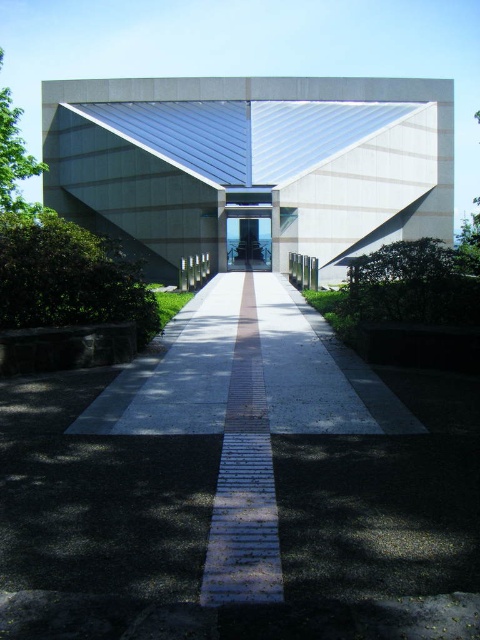
Question: Which point is farther to the camera?

Choices:
 (A) (268, 432)
 (B) (233, 160)
 (C) (254, 227)

Answer: (C)

Question: Is brick paved path at center wider than transparent glass door at center?

Choices:
 (A) no
 (B) yes

Answer: (A)

Question: Among these objects, which one is nearest to the camera?

Choices:
 (A) white smooth concrete corridor at center
 (B) brick paved path at center

Answer: (B)

Question: Does brick paved path at center appear under transparent glass door at center?

Choices:
 (A) yes
 (B) no

Answer: (A)

Question: Is white smooth concrete corridor at center above brick paved path at center?

Choices:
 (A) no
 (B) yes

Answer: (B)

Question: Which point appears farthest from the camera in this image?

Choices:
 (A) click(260, 561)
 (B) click(94, 156)

Answer: (B)